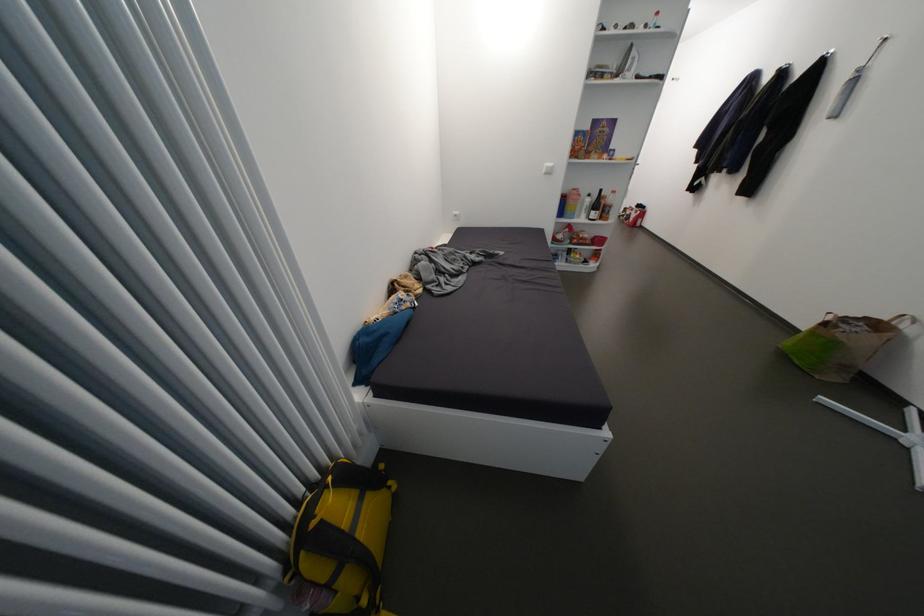
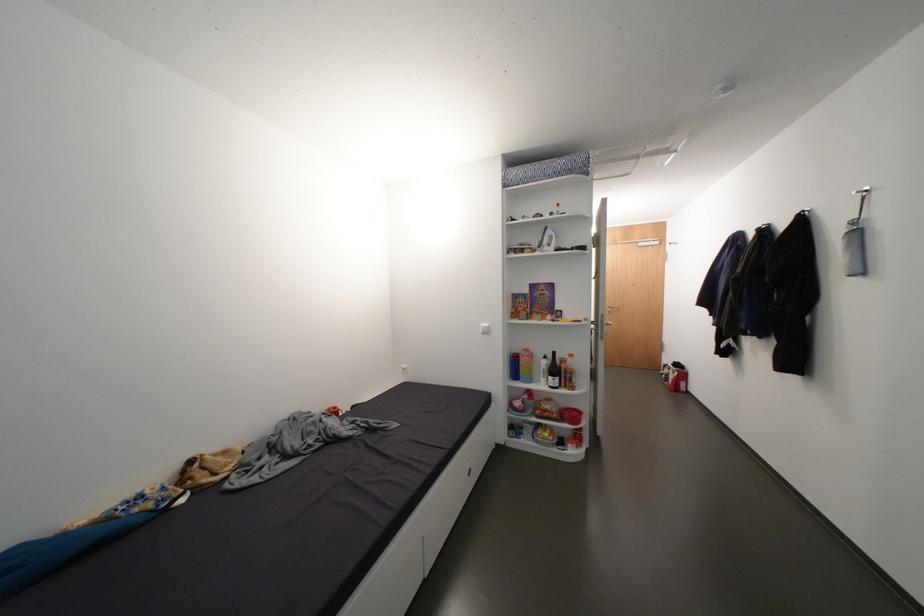
The point at (x=600, y=213) is marked in the first image. Where is the corresponding point in the second image?

(557, 378)